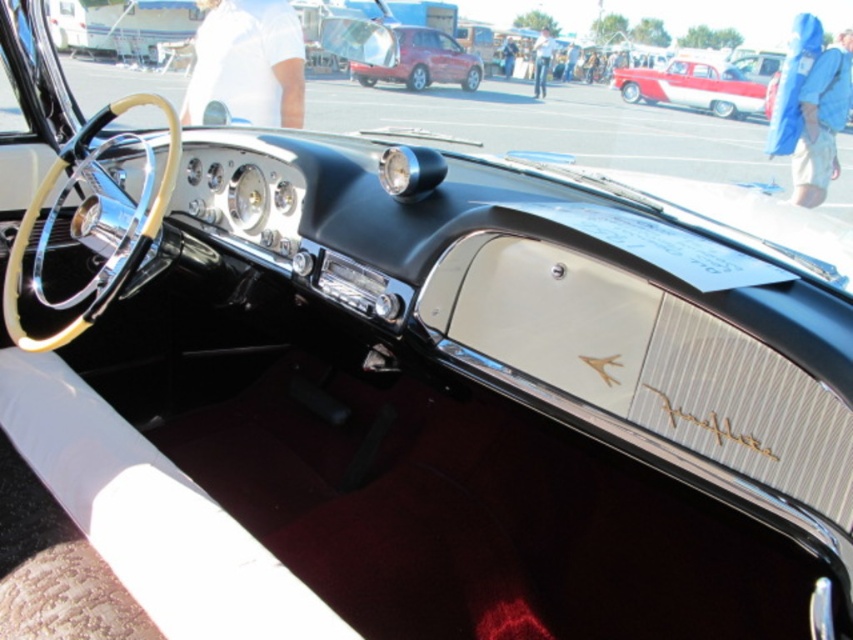
Question: Which object appears closest to the camera in this image?

Choices:
 (A) white glossy sedan at center
 (B) metallic red suv at center

Answer: (B)

Question: Can you confirm if white glossy sedan at center is positioned above metallic red suv at center?

Choices:
 (A) yes
 (B) no

Answer: (A)

Question: Is white glossy sedan at center to the right of metallic red suv at center from the viewer's perspective?

Choices:
 (A) no
 (B) yes

Answer: (B)

Question: Does white glossy sedan at center have a larger size compared to metallic red suv at center?

Choices:
 (A) yes
 (B) no

Answer: (B)

Question: Which of the following is the closest to the observer?

Choices:
 (A) metallic red suv at center
 (B) white glossy sedan at center

Answer: (A)